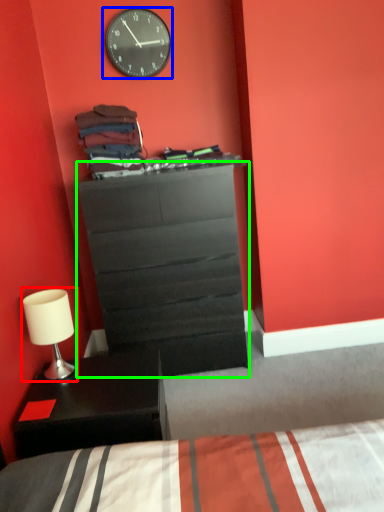
Question: Estimate the real-world distances between objects in this image. Which object is farther from table lamp (highlighted by a red box), wall clock (highlighted by a blue box) or chest of drawers (highlighted by a green box)?

Choices:
 (A) wall clock
 (B) chest of drawers

Answer: (A)